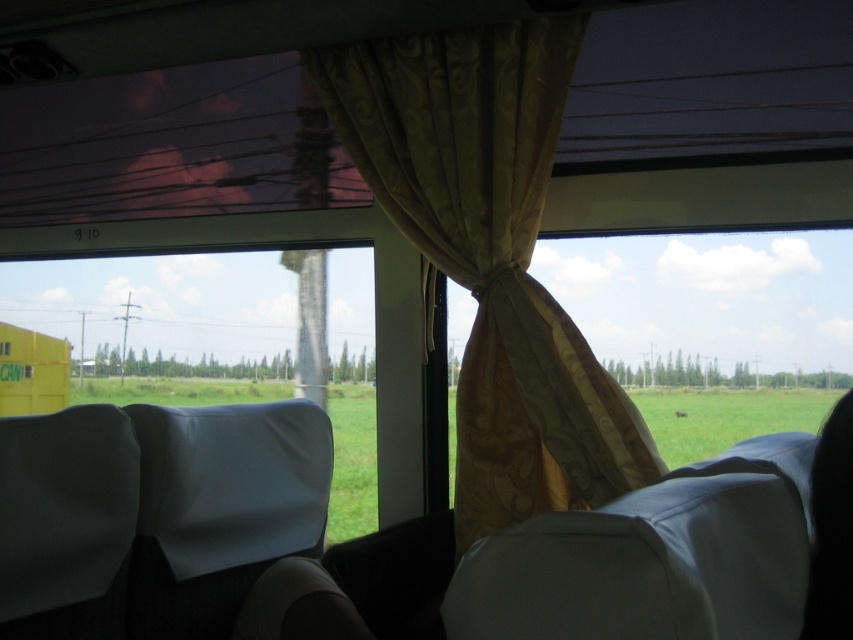
Question: Can you confirm if green matte window at center is positioned above white fabric chair at center?

Choices:
 (A) yes
 (B) no

Answer: (A)

Question: Can you confirm if gold silk curtain at center is positioned to the right of white fabric chair at center?

Choices:
 (A) no
 (B) yes

Answer: (B)

Question: Is gold silk curtain at center to the right of white fabric chair at center from the viewer's perspective?

Choices:
 (A) yes
 (B) no

Answer: (A)

Question: Estimate the real-world distances between objects in this image. Which object is closer to the white fabric chair at center?

Choices:
 (A) green matte window at center
 (B) gold silk curtain at center

Answer: (A)

Question: Which object appears closest to the camera in this image?

Choices:
 (A) green matte window at center
 (B) white fabric chair at center

Answer: (B)

Question: Which of the following is the farthest from the observer?

Choices:
 (A) green matte window at center
 (B) white fabric chair at center
 (C) gold silk curtain at center

Answer: (A)